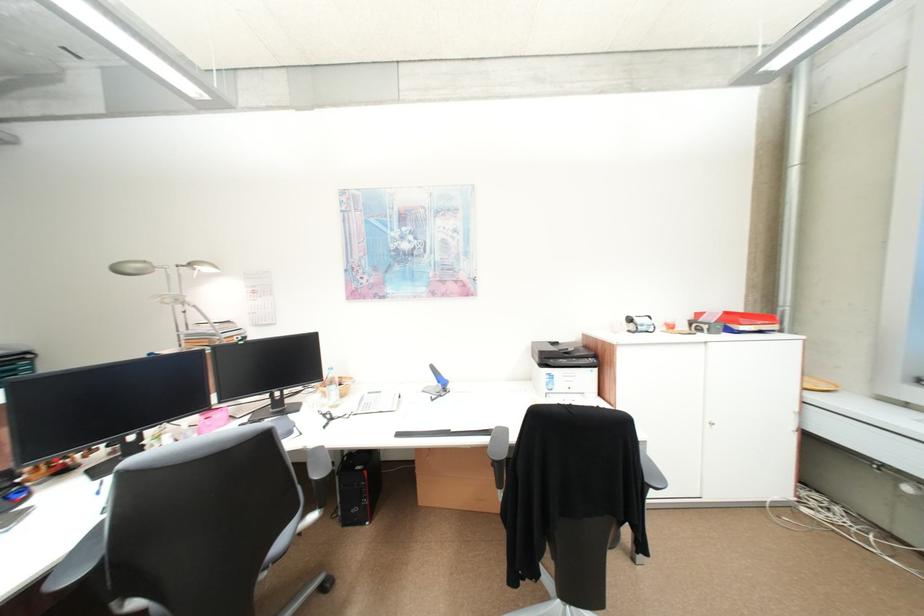
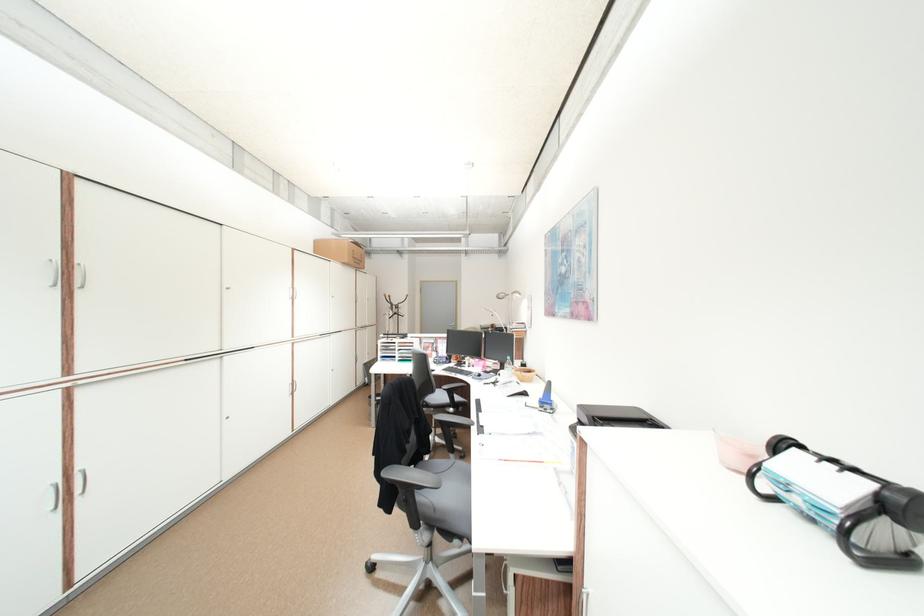
Find the pixel in the second image that matches (x=277, y=403) in the first image.

(507, 368)